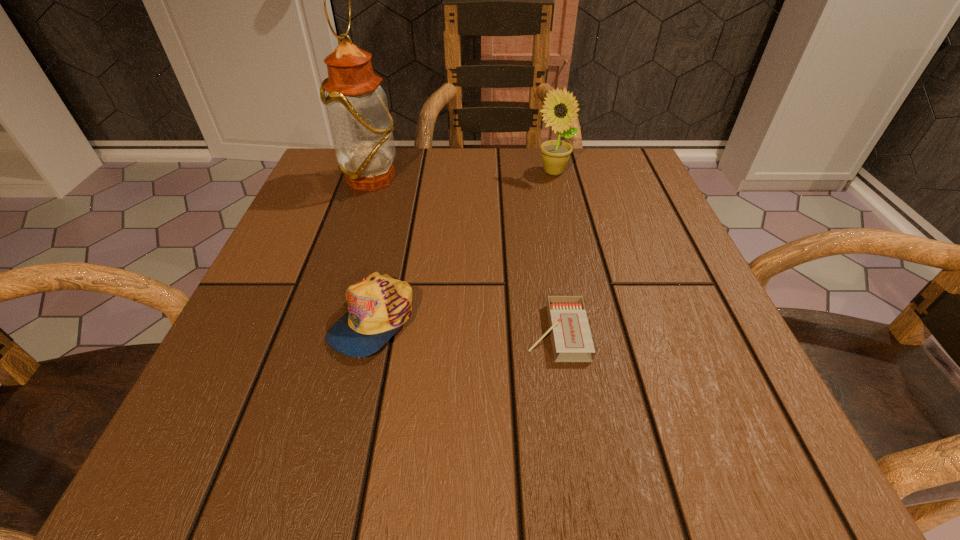
What are the coordinates of `vacant space that's between the tallest object and the matchbox` in the screenshot? It's located at (464, 256).

Identify the location of free space between the third tallest object and the sunflower. tap(463, 246).

Identify which object is the second closest to the tallest object. Please provide its 2D coordinates. Your answer should be formatted as a tuple, i.e. [(x, y)], where the tuple contains the x and y coordinates of a point satisfying the conditions above.

[(560, 110)]

The width and height of the screenshot is (960, 540). I want to click on object that is the second closest to the second tallest object, so click(571, 337).

What are the coordinates of `free spot that satisfies the following two spatial constraints: 1. on the face of the third shortest object; 2. on the striking surface of the matchbox` in the screenshot? It's located at (589, 332).

In order to click on vacant space that satisfies the following two spatial constraints: 1. on the face of the third shortest object; 2. on the striking surface of the matchbox in this screenshot , I will do `click(589, 332)`.